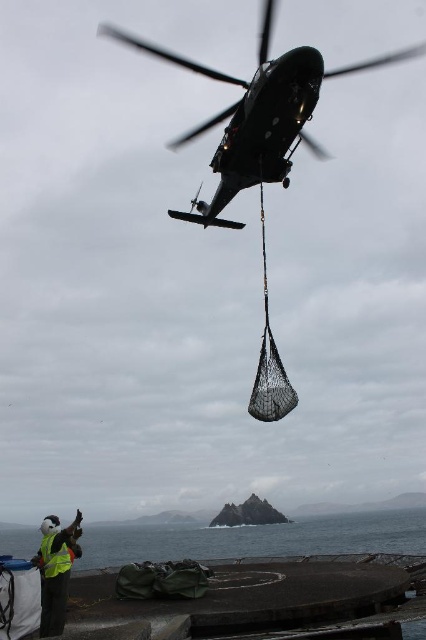
Can you confirm if metallic dark green helicopter at upper center is smaller than black rubber water at lower center?

Incorrect, metallic dark green helicopter at upper center is not smaller in size than black rubber water at lower center.

Who is taller, metallic dark green helicopter at upper center or black rubber water at lower center?

Standing taller between the two is metallic dark green helicopter at upper center.

Between point (236, 115) and point (195, 557), which one is positioned behind?

Positioned behind is point (195, 557).

This screenshot has height=640, width=426. Find the location of `metallic dark green helicopter at upper center`. metallic dark green helicopter at upper center is located at coordinates (259, 115).

Is point (176, 524) positioned before point (49, 552)?

No, (176, 524) is further to viewer.

The width and height of the screenshot is (426, 640). I want to click on black rubber water at lower center, so coord(256,538).

Measure the distance between metallic dark green helicopter at upper center and reflective yellow vest at lower left.

metallic dark green helicopter at upper center and reflective yellow vest at lower left are 61.43 meters apart from each other.

Is point (279, 134) closer to viewer compared to point (69, 529)?

No, (279, 134) is further to viewer.

Is point (239, 186) farther from camera compared to point (63, 620)?

Yes, point (239, 186) is behind point (63, 620).

The image size is (426, 640). Identify the location of metallic dark green helicopter at upper center. (259, 115).